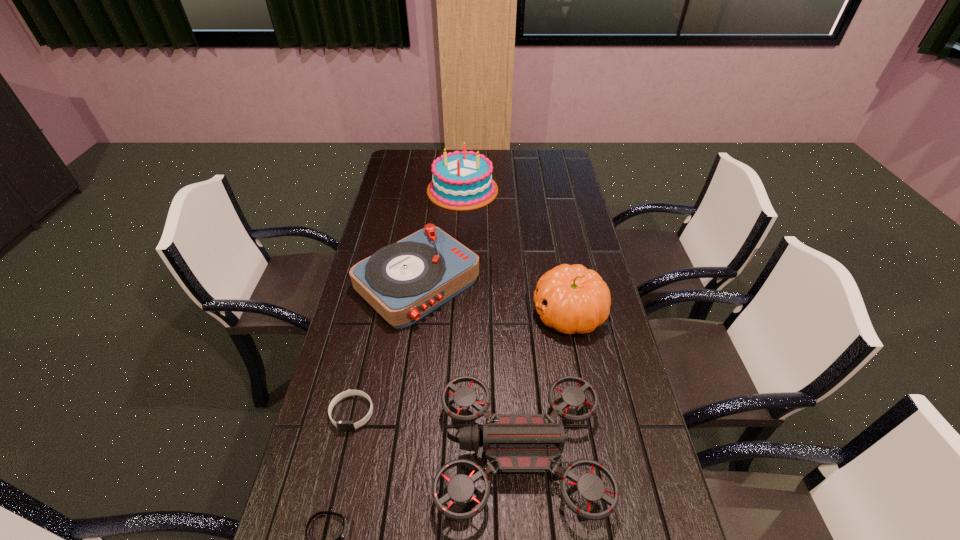
In the image, there is a desktop. Where is `free space at the far edge`? free space at the far edge is located at coordinates (500, 158).

I want to click on free region at the left edge, so tap(337, 413).

What are the coordinates of `vacant area at the right edge` in the screenshot? It's located at (564, 180).

Where is `vacant space at the far left corner`? vacant space at the far left corner is located at coordinates (409, 168).

In the image, there is a desktop. At what (x,y) coordinates should I click in order to perform the action: click on free space at the far right corner. Please return your answer as a coordinate pair (x, y). The width and height of the screenshot is (960, 540). Looking at the image, I should click on (543, 166).

Where is `free space between the fifth tallest object and the record player`? free space between the fifth tallest object and the record player is located at coordinates (385, 348).

Locate an element on the screen. The height and width of the screenshot is (540, 960). free space between the pumpkin and the birthday cake is located at coordinates (516, 252).

Where is `empty space between the second tallest object and the record player`? This screenshot has width=960, height=540. empty space between the second tallest object and the record player is located at coordinates (493, 298).

You are a GUI agent. You are given a task and a screenshot of the screen. Output one action in this format:
    pyautogui.click(x=<x>, y=<y>)
    Task: Click on the free space that is in between the drone and the farther wristband
    The image size is (960, 540).
    Given the screenshot: What is the action you would take?
    [436, 433]

Identify the location of empty space between the record player and the taller wristband. (385, 348).